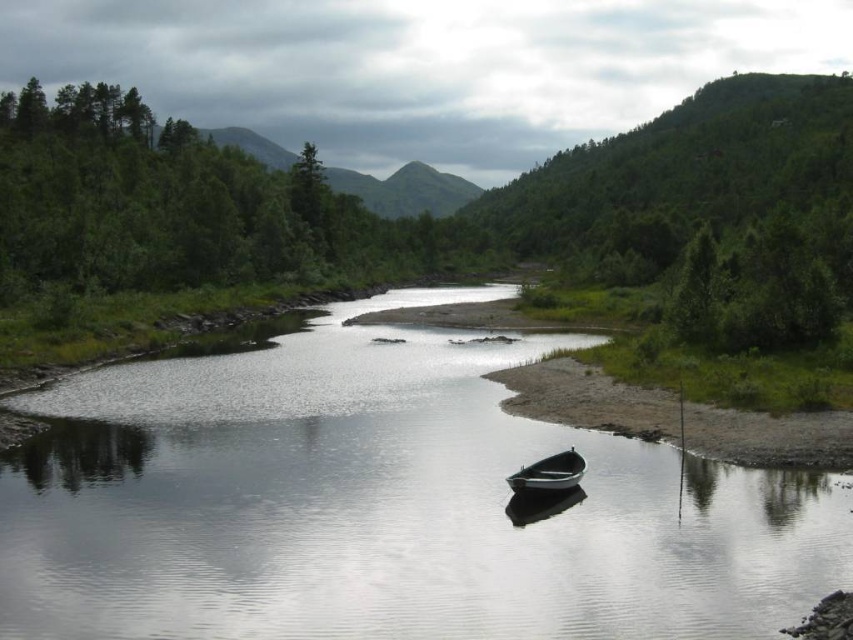
Which is in front, point (141, 588) or point (509, 477)?

Point (141, 588)

Between clear water at center and metallic gray boat at center, which one has more height?

clear water at center

Measure the distance between clear water at center and camera.

18.41 meters

Where is `clear water at center`? The width and height of the screenshot is (853, 640). clear water at center is located at coordinates (381, 506).

Is green leafy tree at center to the right of green grassy shore at lower right from the viewer's perspective?

Yes, green leafy tree at center is to the right of green grassy shore at lower right.

Can you confirm if green leafy tree at center is smaller than green grassy shore at lower right?

Actually, green leafy tree at center might be larger than green grassy shore at lower right.

Is point (778, 138) closer to viewer compared to point (550, 381)?

That is False.

At what (x,y) coordinates should I click in order to perform the action: click on green leafy tree at center. Please return your answer as a coordinate pair (x, y). The width and height of the screenshot is (853, 640). Looking at the image, I should click on (396, 218).

Does green leafy tree at center appear over metallic gray boat at center?

Yes.

Measure the distance between point (309, 216) and camera.

Point (309, 216) is 154.55 meters away from camera.

Is point (82, 200) positioned after point (508, 483)?

Yes, point (82, 200) is farther from viewer.

Identify the location of green leafy tree at center. The image size is (853, 640). (396, 218).